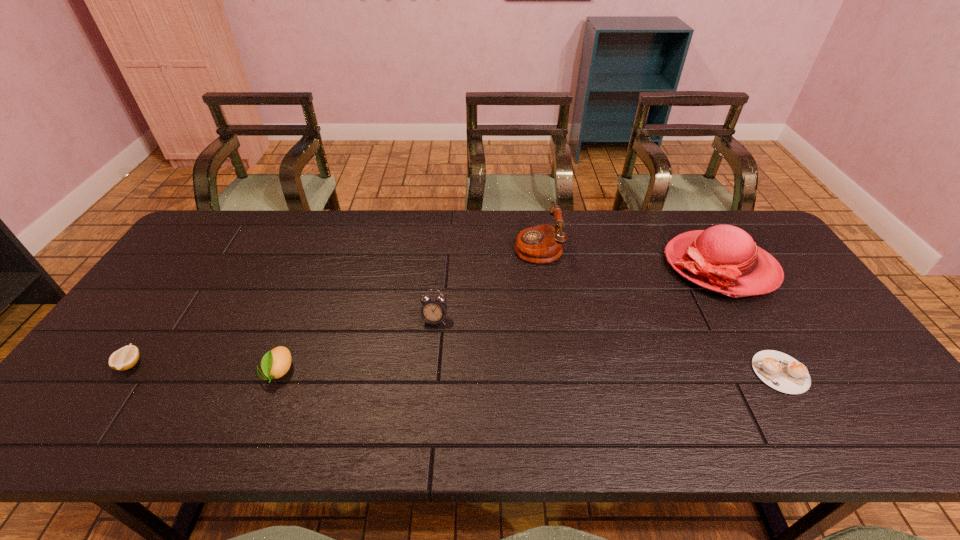
Find the location of `object that is the fourth closest one to the third shortest object`. object that is the fourth closest one to the third shortest object is located at coordinates pyautogui.click(x=723, y=258).

The height and width of the screenshot is (540, 960). In order to click on free space that satisfies the following two spatial constraints: 1. on the face of the third farthest object; 2. on the left side of the cappuccino in this screenshot , I will do `click(429, 372)`.

You are a GUI agent. You are given a task and a screenshot of the screen. Output one action in this format:
    pyautogui.click(x=<x>, y=<y>)
    Task: Click on the free space that satisfies the following two spatial constraints: 1. with leaves positioned above the cappuccino; 2. on the left side of the taller lemon
    The image size is (960, 540).
    Given the screenshot: What is the action you would take?
    [x=278, y=372]

The image size is (960, 540). I want to click on vacant space that satisfies the following two spatial constraints: 1. on the dial of the telephone; 2. with leaves positioned above the second object from left to right, so pos(557,372).

You are a GUI agent. You are given a task and a screenshot of the screen. Output one action in this format:
    pyautogui.click(x=<x>, y=<y>)
    Task: Click on the free spot that satisfies the following two spatial constraints: 1. on the dial of the fourth object from left to right; 2. on the face of the alarm clock
    This screenshot has height=540, width=960.
    Given the screenshot: What is the action you would take?
    pyautogui.click(x=549, y=320)

Image resolution: width=960 pixels, height=540 pixels. Find the location of `free location that satisfies the following two spatial constraints: 1. on the back side of the cappuccino; 2. on the dial of the third object from right to left`. free location that satisfies the following two spatial constraints: 1. on the back side of the cappuccino; 2. on the dial of the third object from right to left is located at coordinates (706, 246).

At what (x,y) coordinates should I click in order to perform the action: click on vacant space that satisfies the following two spatial constraints: 1. on the dial of the fourth object from left to right; 2. on the face of the fourth object from right to left. Please return your answer as a coordinate pair (x, y). Looking at the image, I should click on (549, 320).